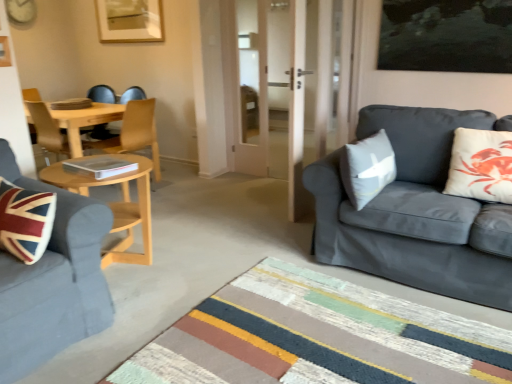
Question: Which is correct: wooden chair at center is inside light wood coffee table at center left, or outside of it?

Choices:
 (A) inside
 (B) outside

Answer: (B)

Question: Does point tap(143, 132) appear closer or farther from the camera than point tap(145, 213)?

Choices:
 (A) farther
 (B) closer

Answer: (A)

Question: Based on their relative distances, which object is nearer to the wooden chair at center?

Choices:
 (A) white matte cushion at right, placed as the 1th pillow when sorted from right to left
 (B) striped rug at center
 (C) dark gray fabric couch at right, the 1th studio couch positioned from the right
 (D) velvet blue sofa at left, the 1th studio couch from the left
 (E) gray fabric pillow at right, which is counted as the first pillow, starting from the left

Answer: (D)

Question: Which object is the closest to the gray fabric pillow at right, the 2th pillow when ordered from right to left?

Choices:
 (A) velvet blue sofa at left, the 1th studio couch from the left
 (B) dark gray fabric couch at right, the 1th studio couch positioned from the right
 (C) striped rug at center
 (D) light wood coffee table at center left
 (E) wooden chair at center

Answer: (B)